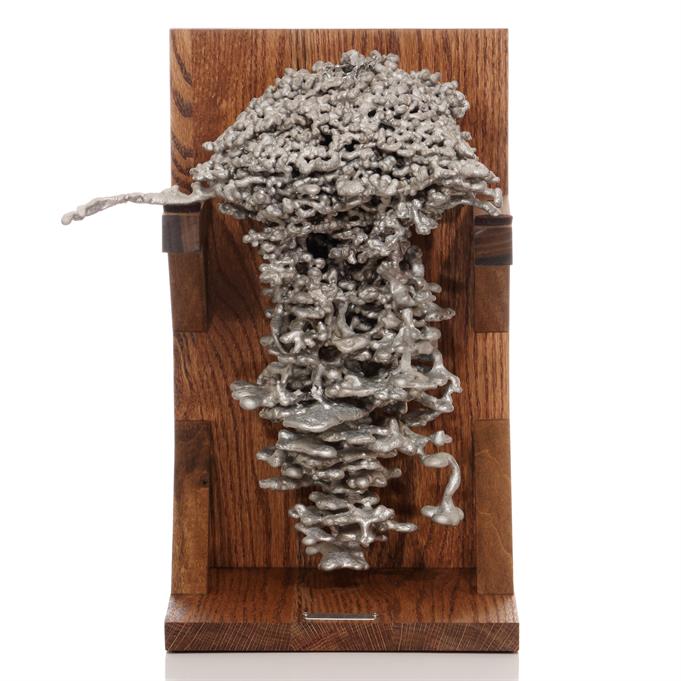
In order to click on silver placque in this screenshot , I will do `click(319, 614)`.